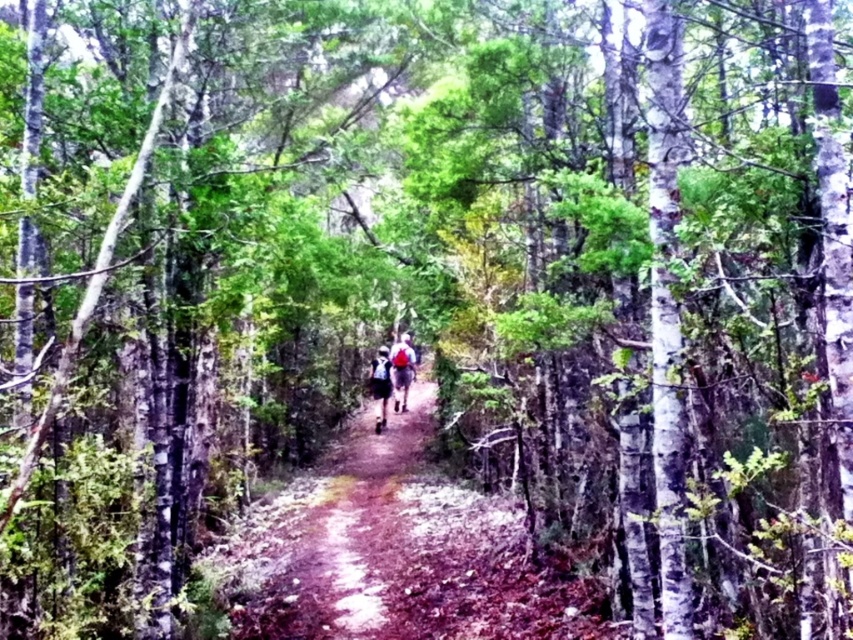
You are a hiker standing on the dirt path in the forest. You see two points marked on the path ahead of you. The first point is at coordinates point [276,596] and the second point is at coordinates point [404,410]. Which point is closer to your current position?

Point [276,596] is closer to the viewer than point [404,410], so the first point is closer to your current position.

You are a hiker standing at the point marked by the coordinates [401,371] in the forest scene. What object are you currently standing on?

The point at coordinates [401,371] is on the red backpack at center, so you are standing on the red backpack at center.